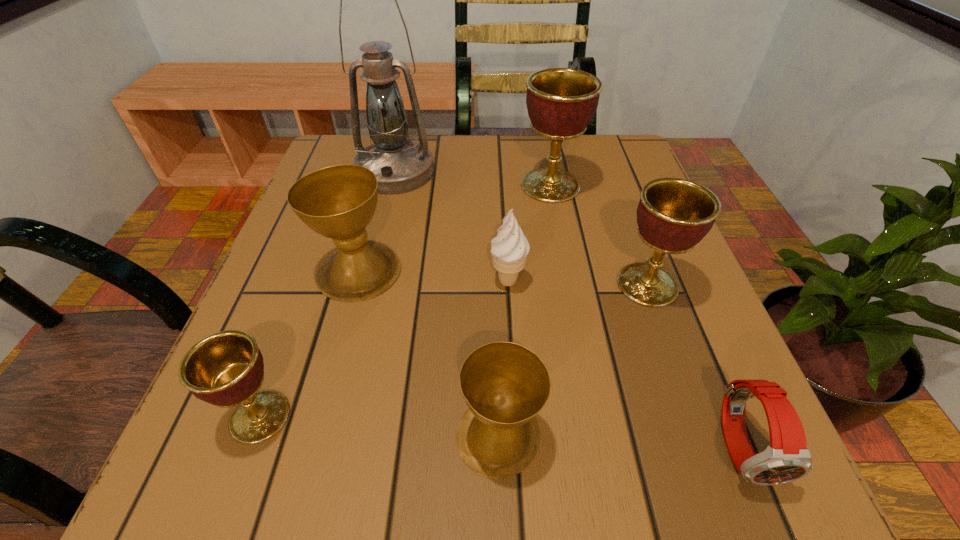
Identify which golden chalice is the closest to the red watch. Please provide its 2D coordinates. Your answer should be formatted as a tuple, i.e. [(x, y)], where the tuple contains the x and y coordinates of a point satisfying the conditions above.

[(673, 215)]

The width and height of the screenshot is (960, 540). I want to click on golden chalice that stands as the second closest to the farthest golden chalice, so click(x=226, y=369).

Identify the location of vacant space that satisfies the following two spatial constraints: 1. on the front side of the tallest object; 2. on the left side of the seventh shortest object. (392, 186).